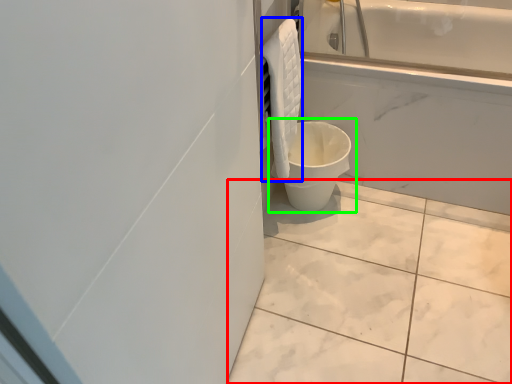
Question: Which is nearer to the ceramic tile (highlighted by a red box)? material (highlighted by a blue box) or toilet (highlighted by a green box).

Choices:
 (A) material
 (B) toilet

Answer: (B)